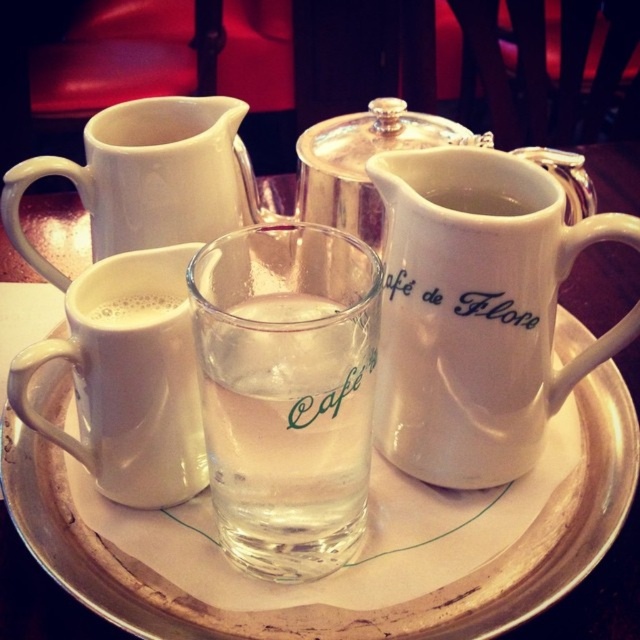
Is white ceramic plate at center bigger than white ceramic pitcher at upper center?

Indeed, white ceramic plate at center has a larger size compared to white ceramic pitcher at upper center.

Who is more distant from viewer, (512, 604) or (465, 202)?

The point (465, 202) is more distant.

Where is `white ceramic plate at center`? white ceramic plate at center is located at coordinates (332, 605).

What do you see at coordinates (132, 310) in the screenshot?
I see `white frothy coffee at upper left` at bounding box center [132, 310].

Locate an element on the screen. white frothy coffee at upper left is located at coordinates (132, 310).

Describe the element at coordinates (128, 378) in the screenshot. I see `white matte mug at left` at that location.

The image size is (640, 640). What do you see at coordinates (128, 378) in the screenshot?
I see `white matte mug at left` at bounding box center [128, 378].

Image resolution: width=640 pixels, height=640 pixels. Identify the location of white matte mug at left. (128, 378).